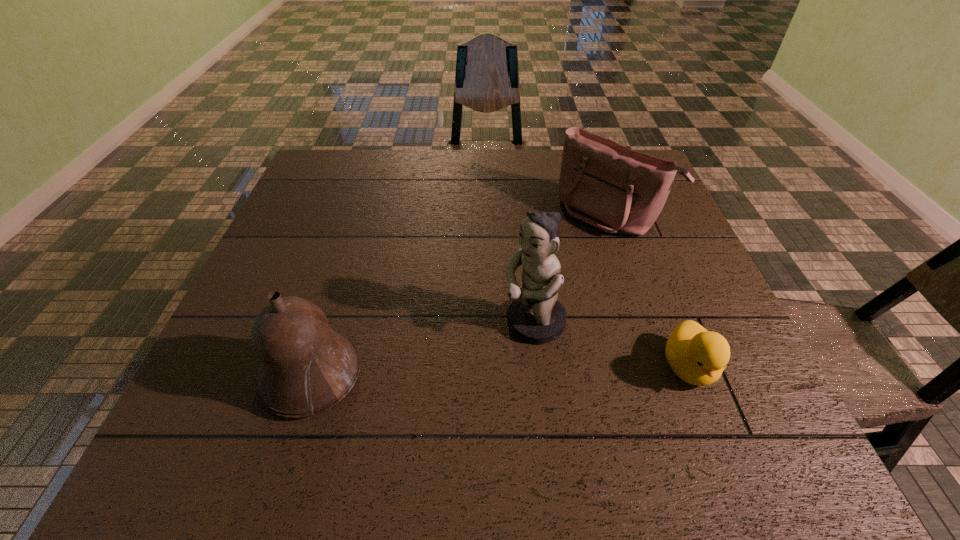
You are a GUI agent. You are given a task and a screenshot of the screen. Output one action in this format:
    pyautogui.click(x=<x>, y=<y>)
    Task: Click on the free region that satisfies the following two spatial constraints: 1. on the back side of the shoulder bag; 2. on the right side of the bell
    
    Given the screenshot: What is the action you would take?
    pyautogui.click(x=362, y=214)

At what (x,y) coordinates should I click in order to perform the action: click on free location that satisfies the following two spatial constraints: 1. on the back side of the leftmost object; 2. on the left side of the third object from right to left. Please return your answer as a coordinate pair (x, y). This screenshot has height=540, width=960. Looking at the image, I should click on (328, 323).